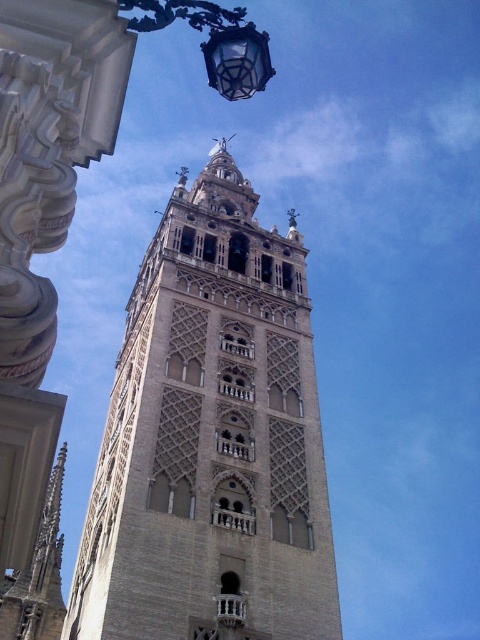
You are a bird flying towards the beige stone bell tower at center and the clear glass lantern at upper center. Which object will you reach first?

The beige stone bell tower at center will be reached first because the clear glass lantern at upper center is positioned behind it.

You are standing at a certain distance from the beige stone bell tower at center. If you want to take a photo that captures the entire tower without any cropping, would you need to move closer or farther away?

The beige stone bell tower at center is 113.30 feet away from the camera. To capture the entire tower in the photo without cropping, you would need to move farther away from the beige stone bell tower at center to ensure the entire structure fits within the camera frame.

You are standing in front of the tower and want to take a photo that includes both the pointed spire with a cross at its peak and the point at coordinates [186,509]. Given that the point is 41.76 meters away from you, will you need to zoom in or out to ensure both are in frame?

The point at coordinates [186,509] is 41.76 meters away from the camera. Since the pointed spire with a cross at its peak is part of the tower, which is presumably further away than the point, you would need to zoom out to ensure both are in frame.